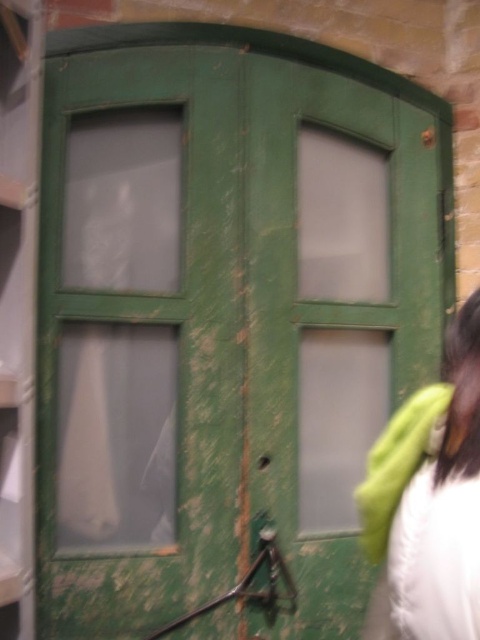
You are standing in front of the green wooden door with a curved top. You see a white fabric at right and a green matte jacket at lower right. How far apart are these two items?

The distance between the white fabric at right and the green matte jacket at lower right is 6.12 inches.

You are standing in front of the green wooden door with a curved top. You notice two items to your right side. What is the position of the white fabric at right compared to the green matte jacket at lower right?

The white fabric at right is located below the green matte jacket at lower right.